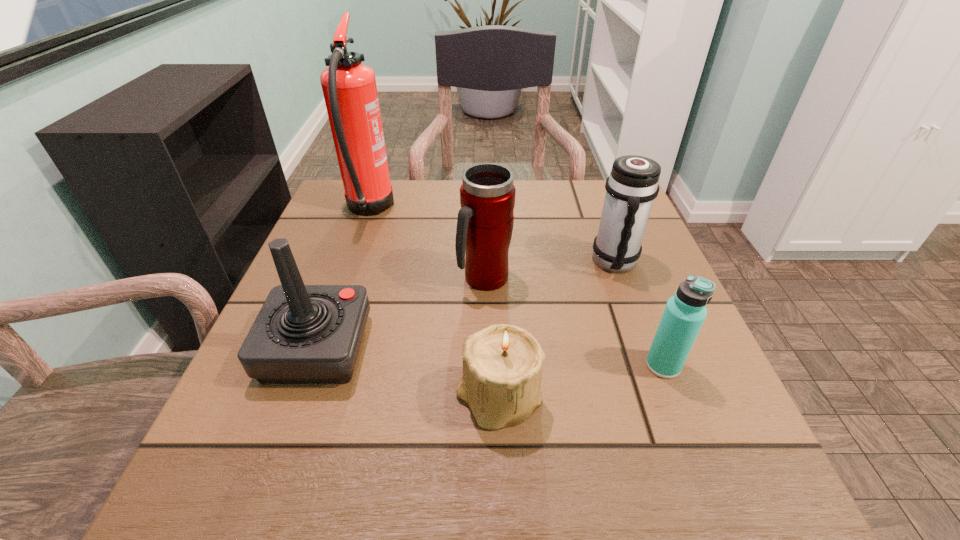
Identify the location of vacant space at the far right corner of the desktop. The image size is (960, 540). 579,197.

The image size is (960, 540). In order to click on vacant space at the near right corner of the desktop in this screenshot , I will do `click(750, 485)`.

Locate an element on the screen. empty space between the shortest object and the nearest thermos bottle is located at coordinates (581, 382).

This screenshot has height=540, width=960. I want to click on free area in between the farthest object and the shortest object, so click(434, 304).

Where is `empty location between the joystick and the candle_holder`? empty location between the joystick and the candle_holder is located at coordinates (408, 373).

Image resolution: width=960 pixels, height=540 pixels. What are the coordinates of `vacant area that lies between the leftmost thermos bottle and the tallest object` in the screenshot? It's located at (426, 244).

Identify the location of free point between the joystick and the farthest object. (343, 279).

Find the location of `free spot between the joystick and the farthest object`. free spot between the joystick and the farthest object is located at coordinates (343, 279).

Where is `free space between the shortest thermos bottle and the shortest object`? The height and width of the screenshot is (540, 960). free space between the shortest thermos bottle and the shortest object is located at coordinates (581, 382).

This screenshot has height=540, width=960. I want to click on the fourth closest object relative to the shortest object, so click(x=632, y=186).